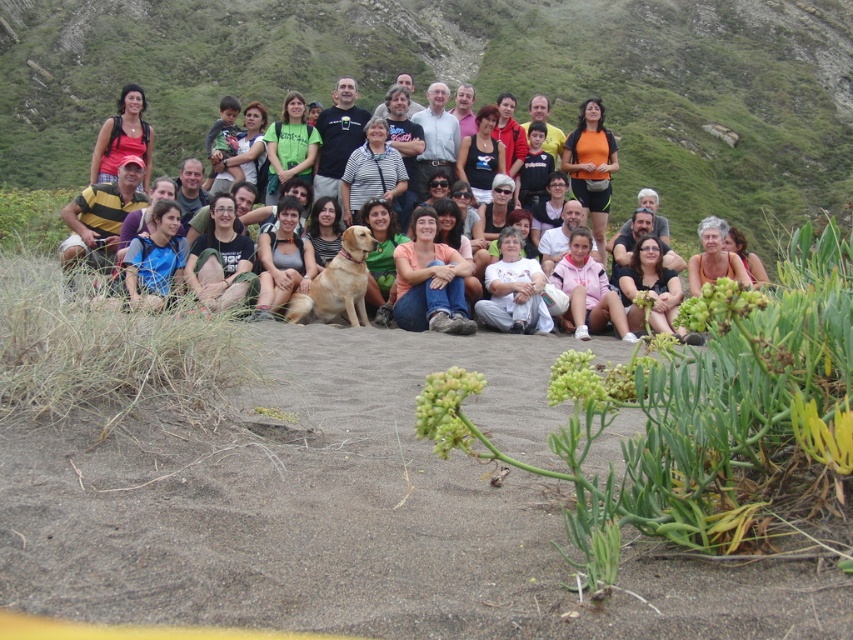
Does brown sandy soil at center appear on the left side of matte black backpack at center?

Incorrect, brown sandy soil at center is not on the left side of matte black backpack at center.

Between point (305, 396) and point (103, 173), which one is positioned in front?

Point (305, 396) is more forward.

The height and width of the screenshot is (640, 853). I want to click on brown sandy soil at center, so click(x=326, y=493).

Identify the location of brown sandy soil at center. (326, 493).

Does matte orange shirt at center lie in front of matte black backpack at center?

Yes.

Between matte orange shirt at center and matte black backpack at center, which one has less height?

matte orange shirt at center

Who is more distant from viewer, (404, 276) or (138, 109)?

Point (138, 109)

The height and width of the screenshot is (640, 853). In order to click on matte orange shirt at center in this screenshot , I will do `click(430, 280)`.

Can you confirm if matte black shirt at center is positioned below matte black backpack at center?

Yes, matte black shirt at center is below matte black backpack at center.

Between point (599, 248) and point (136, 108), which one is positioned in front?

Positioned in front is point (136, 108).

What do you see at coordinates (712, 259) in the screenshot?
I see `matte black shirt at center` at bounding box center [712, 259].

Where is `matte black shirt at center`? matte black shirt at center is located at coordinates (712, 259).